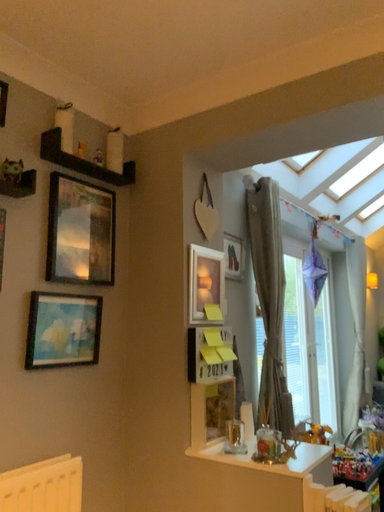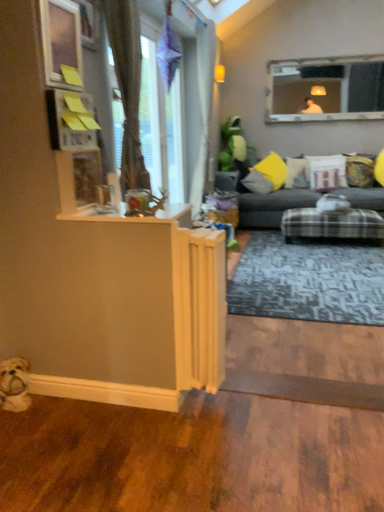
Question: How did the camera likely rotate when shooting the video?

Choices:
 (A) rotated downward
 (B) rotated upward

Answer: (A)